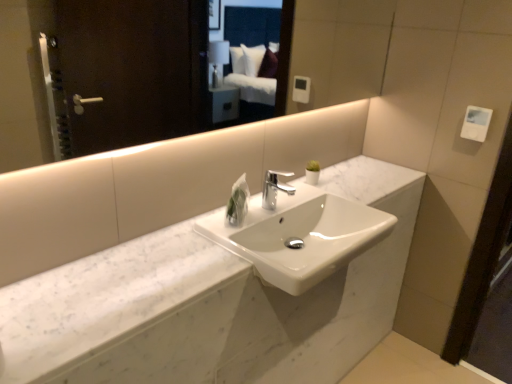
Describe the element at coordinates (340, 49) in the screenshot. I see `white glossy mirror at upper center` at that location.

Locate an element on the screen. white glossy mirror at upper center is located at coordinates click(340, 49).

I want to click on white marble counter at center, so click(211, 304).

The width and height of the screenshot is (512, 384). What are the coordinates of `polished chrome faucet at center` in the screenshot? It's located at (275, 188).

I want to click on white plastic hand dryer at upper right, so pos(476,123).

Does white plastic hand dryer at upper right touch polished chrome faucet at center?

white plastic hand dryer at upper right and polished chrome faucet at center are not in contact.

Relative to polished chrome faucet at center, is white plastic hand dryer at upper right in front or behind?

white plastic hand dryer at upper right is positioned farther from the viewer than polished chrome faucet at center.

In terms of size, does white plastic hand dryer at upper right appear bigger or smaller than polished chrome faucet at center?

Considering their sizes, white plastic hand dryer at upper right takes up less space than polished chrome faucet at center.

Do you think white marble sink at center is within polished chrome faucet at center, or outside of it?

white marble sink at center is spatially situated outside polished chrome faucet at center.

Does point (367, 233) appear closer or farther from the camera than point (265, 190)?

Point (367, 233) appears to be closer to the viewer than point (265, 190).

Considering the positions of objects white marble sink at center and polished chrome faucet at center in the image provided, who is more to the left, white marble sink at center or polished chrome faucet at center?

polished chrome faucet at center is more to the left.

Considering the sizes of objects white marble sink at center and polished chrome faucet at center in the image provided, who is wider, white marble sink at center or polished chrome faucet at center?

Wider between the two is white marble sink at center.

Is polished chrome faucet at center inside white glossy mirror at upper center?

That's incorrect, polished chrome faucet at center is not inside white glossy mirror at upper center.

Is point (36, 149) positioned behind point (278, 173)?

Yes, it is.

Can you confirm if white glossy mirror at upper center is taller than polished chrome faucet at center?

Yes.

Based on the photo, which object is wider, white glossy mirror at upper center or polished chrome faucet at center?

Wider between the two is polished chrome faucet at center.

Do you think polished chrome faucet at center is within white marble sink at center, or outside of it?

polished chrome faucet at center cannot be found inside white marble sink at center.

Considering the sizes of objects polished chrome faucet at center and white marble sink at center in the image provided, who is taller, polished chrome faucet at center or white marble sink at center?

white marble sink at center is taller.

Between polished chrome faucet at center and white marble sink at center, which one appears on the left side from the viewer's perspective?

Positioned to the left is polished chrome faucet at center.

Can you see polished chrome faucet at center touching white marble sink at center?

polished chrome faucet at center and white marble sink at center are clearly separated.

Is white marble counter at center inside the boundaries of white plastic hand dryer at upper right, or outside?

The correct answer is: outside.

Considering the sizes of white marble counter at center and white plastic hand dryer at upper right in the image, is white marble counter at center taller or shorter than white plastic hand dryer at upper right?

Clearly, white marble counter at center is shorter compared to white plastic hand dryer at upper right.

Is white marble counter at center smaller than white plastic hand dryer at upper right?

Incorrect, white marble counter at center is not smaller in size than white plastic hand dryer at upper right.

How many degrees apart are the facing directions of white marble sink at center and white glossy mirror at upper center?

They differ by 0.0237 degrees in their facing directions.

Which of these two, white marble sink at center or white glossy mirror at upper center, is thinner?

With smaller width is white glossy mirror at upper center.

Is point (221, 239) positioned behind point (336, 13)?

No, it is not.

How much distance is there between white marble sink at center and white glossy mirror at upper center?

93.78 centimeters.

Considering the sizes of white marble counter at center and white glossy mirror at upper center in the image, is white marble counter at center wider or thinner than white glossy mirror at upper center?

white marble counter at center is wider than white glossy mirror at upper center.

Is white marble counter at center not within white glossy mirror at upper center?

Yes, white marble counter at center is not within white glossy mirror at upper center.

This screenshot has height=384, width=512. What are the coordinates of `hand dryer lying above the polished chrome faucet at center (from the image's perspective)` in the screenshot? It's located at (476, 123).

Locate an element on the screen. tap that appears behind the white marble sink at center is located at coordinates (275, 188).

Looking at the image, which one is located closer to polished chrome faucet at center, white glossy mirror at upper center or white marble counter at center?

white marble counter at center is closer to polished chrome faucet at center.

Estimate the real-world distances between objects in this image. Which object is closer to white plastic hand dryer at upper right, white glossy mirror at upper center or polished chrome faucet at center?

white glossy mirror at upper center.

Which object lies nearer to the anchor point white plastic hand dryer at upper right, white glossy mirror at upper center or white marble sink at center?

Based on the image, white glossy mirror at upper center appears to be nearer to white plastic hand dryer at upper right.

In the scene shown: Considering their positions, is white marble sink at center positioned further to white glossy mirror at upper center than white marble counter at center?

Based on the image, white marble counter at center appears to be further to white glossy mirror at upper center.

Looking at the image, which one is located further to white marble sink at center, white marble counter at center or polished chrome faucet at center?

white marble counter at center is positioned further to the anchor white marble sink at center.

Based on the photo, looking at the image, which one is located further to white glossy mirror at upper center, white plastic hand dryer at upper right or white marble sink at center?

white marble sink at center lies further to white glossy mirror at upper center than the other object.

From the image, which object appears to be farther from polished chrome faucet at center, white plastic hand dryer at upper right or white glossy mirror at upper center?

white plastic hand dryer at upper right is further to polished chrome faucet at center.

When comparing their distances from white marble sink at center, does white marble counter at center or white glossy mirror at upper center seem closer?

Based on the image, white marble counter at center appears to be nearer to white marble sink at center.

You are a GUI agent. You are given a task and a screenshot of the screen. Output one action in this format:
    pyautogui.click(x=<x>, y=<y>)
    Task: Click on the counter between white glossy mirror at upper center and white marble sink at center in the vertical direction
    
    Given the screenshot: What is the action you would take?
    pyautogui.click(x=211, y=304)

Where is `sink positioned between white marble counter at center and polished chrome faucet at center from near to far`? sink positioned between white marble counter at center and polished chrome faucet at center from near to far is located at coordinates (298, 235).

The height and width of the screenshot is (384, 512). Find the location of `sink between polished chrome faucet at center and white plastic hand dryer at upper right in the horizontal direction`. sink between polished chrome faucet at center and white plastic hand dryer at upper right in the horizontal direction is located at coordinates (x=298, y=235).

Image resolution: width=512 pixels, height=384 pixels. Identify the location of tap located between white glossy mirror at upper center and white plastic hand dryer at upper right in the left-right direction. (275, 188).